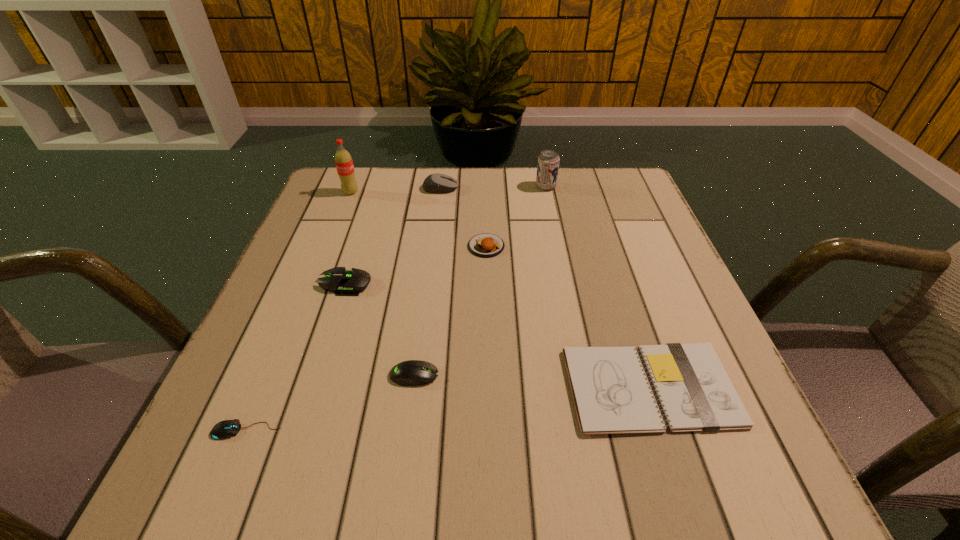
Find the location of a particular element. vacant space that satisfies the following two spatial constraints: 1. on the back side of the patty (food); 2. on the right side of the third nearest mouse is located at coordinates (358, 246).